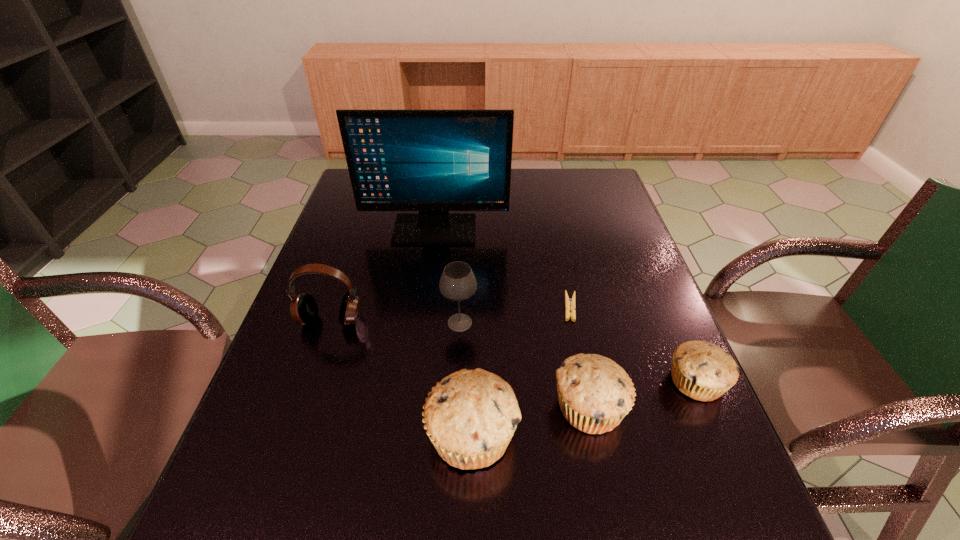
You are a GUI agent. You are given a task and a screenshot of the screen. Output one action in this format:
    pyautogui.click(x=<x>, y=<y>)
    Task: Click on the vacant space that satisfies the following two spatial constraints: 1. on the screen side of the farthest object; 2. on the right side of the shortest object
    This screenshot has height=540, width=960.
    Given the screenshot: What is the action you would take?
    pyautogui.click(x=425, y=307)